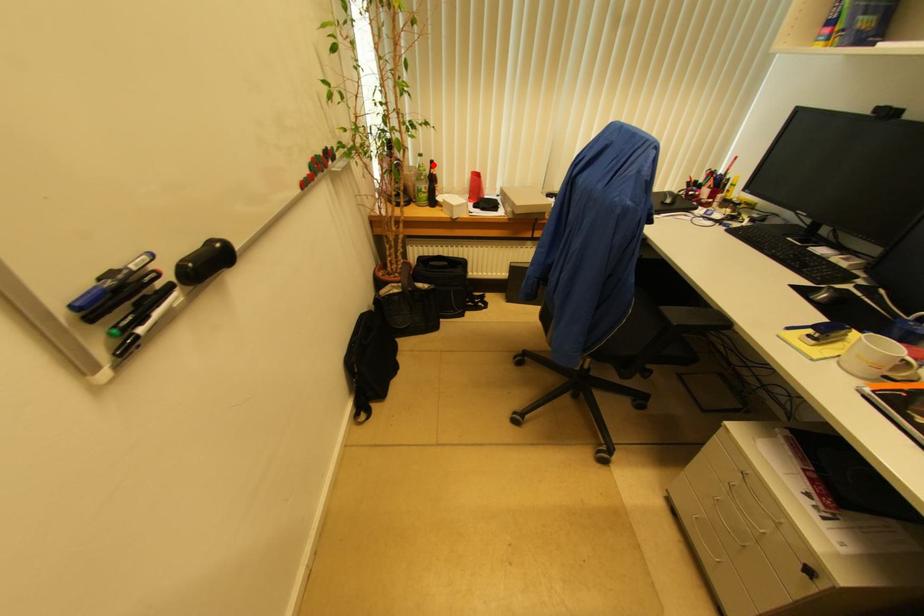
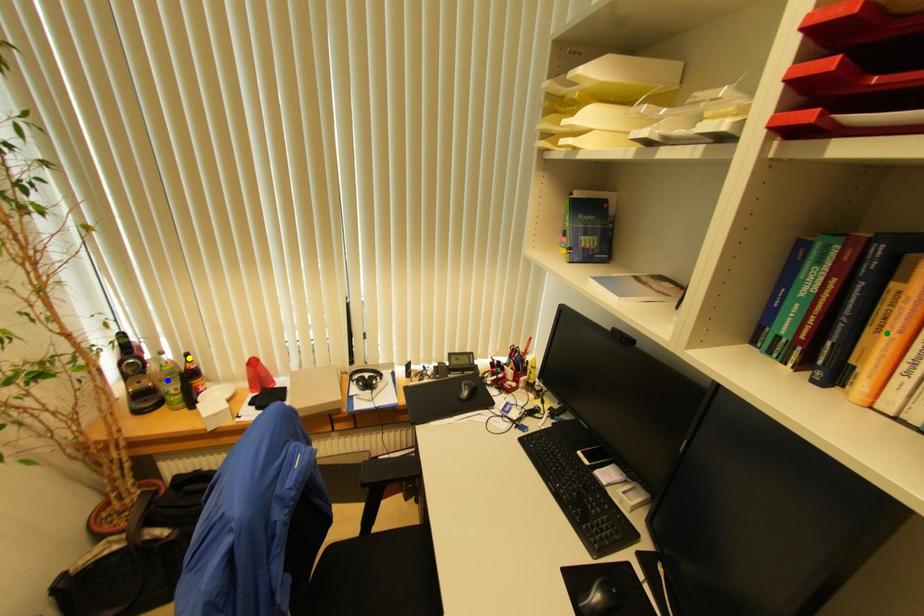
Question: I am providing you with two images of the same scene from different viewpoints. A red point is marked on the first image. You are given multiple points on the second image. Which point in image 2 is actually the same real-world point as the red point in image 1?

Choices:
 (A) green point
 (B) yellow point
 (C) blue point

Answer: (B)